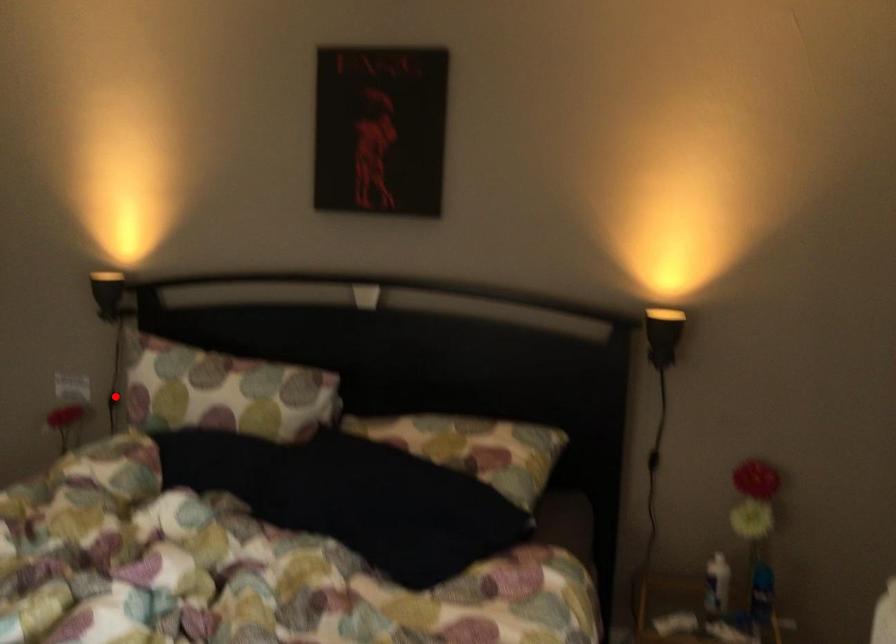
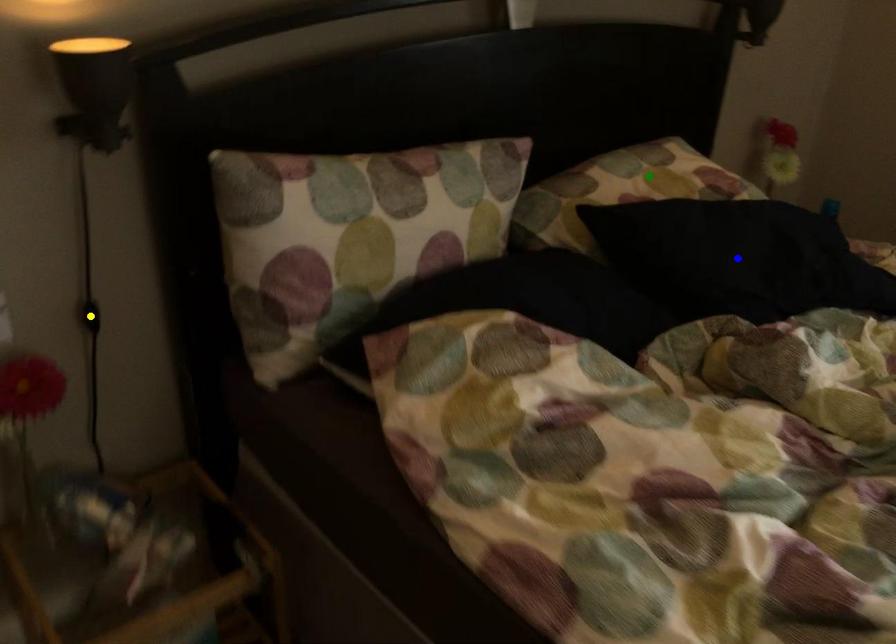
Question: I am providing you with two images of the same scene from different viewpoints. A red point is marked on the first image. You are given multiple points on the second image. In image 2, which mark is for the same physical point as the one in image 1?

Choices:
 (A) blue point
 (B) green point
 (C) yellow point

Answer: (C)